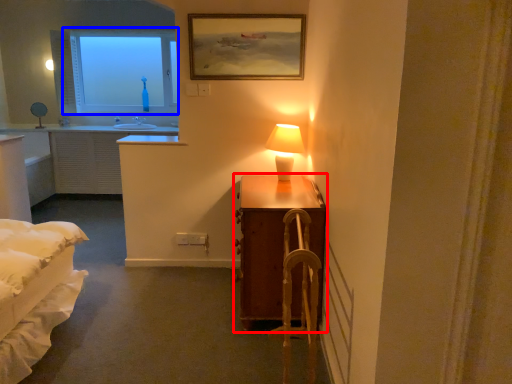
Question: Which object is closer to the camera taking this photo, table (highlighted by a red box) or window (highlighted by a blue box)?

Choices:
 (A) table
 (B) window

Answer: (A)